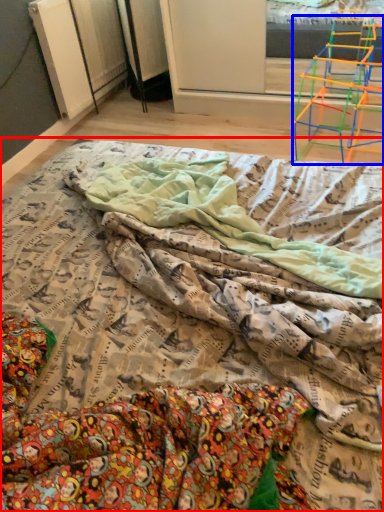
Question: Which object is further to the camera taking this photo, bed (highlighted by a red box) or furniture (highlighted by a blue box)?

Choices:
 (A) bed
 (B) furniture

Answer: (B)